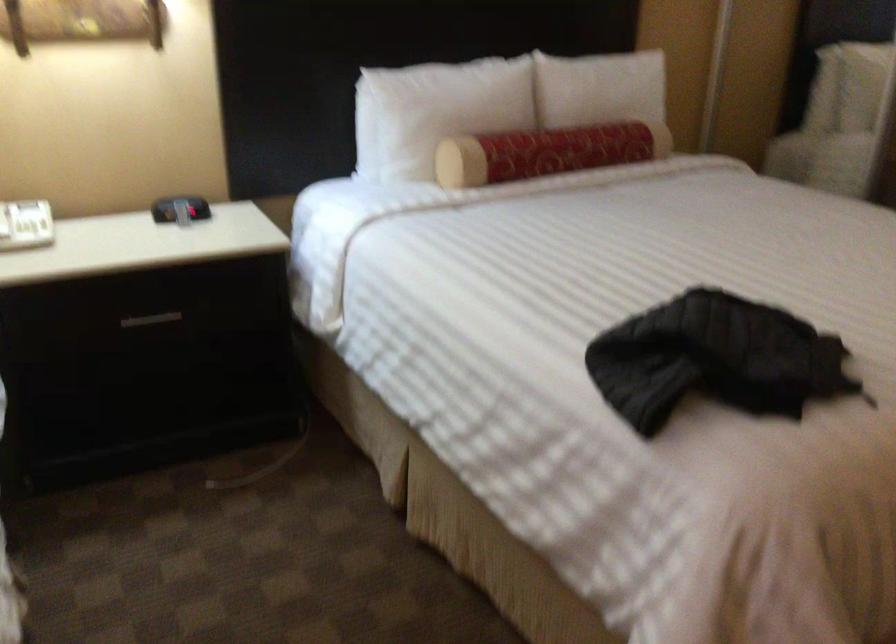
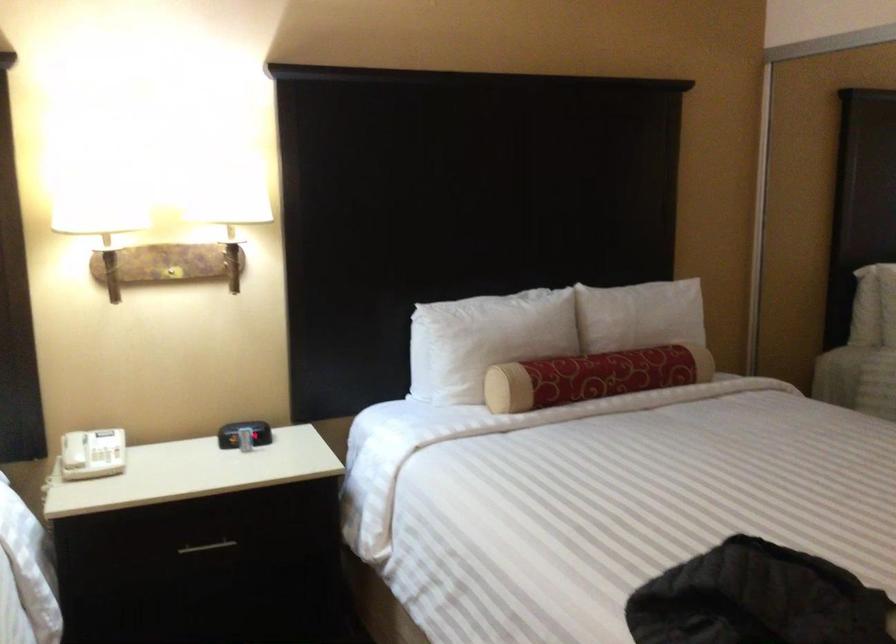
The point at (440, 111) is marked in the first image. Where is the corresponding point in the second image?

(485, 339)